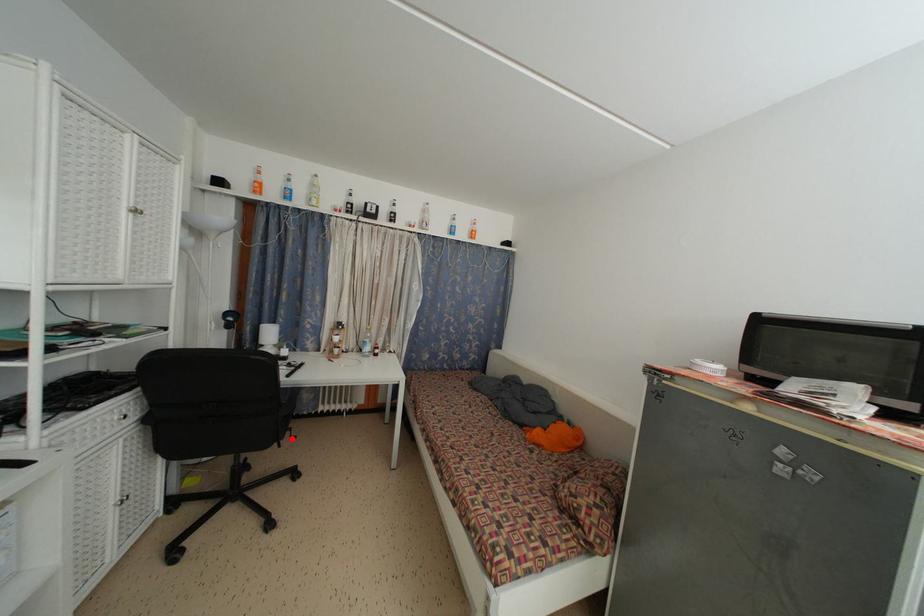
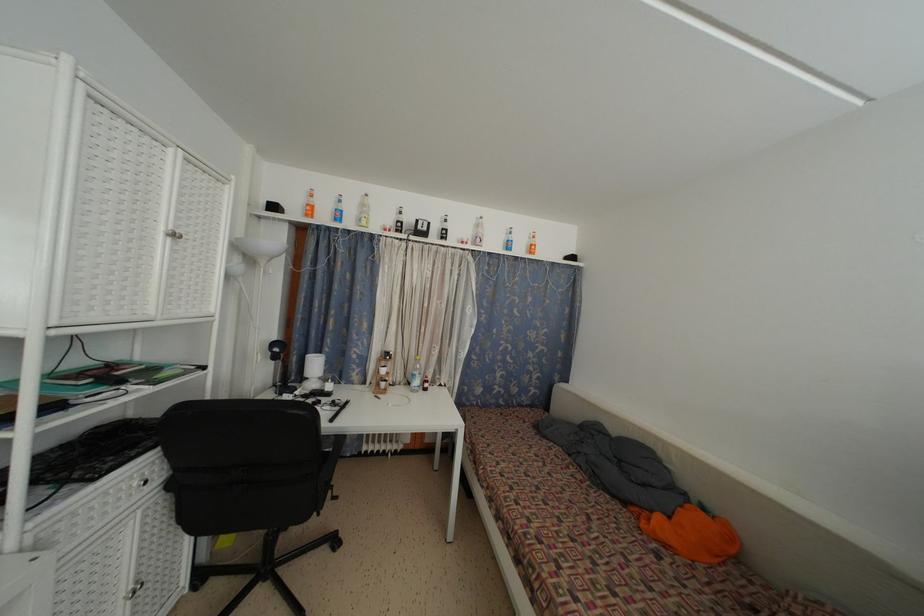
In the second image, find the point that corresponds to the highlighted location in the first image.

(333, 498)